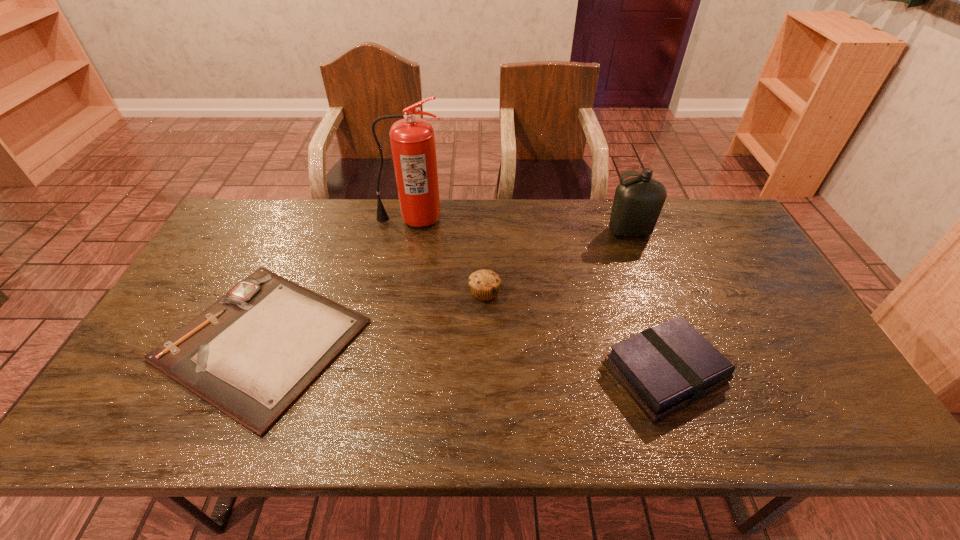
Image resolution: width=960 pixels, height=540 pixels. I want to click on the tallest object, so click(x=412, y=139).

I want to click on bottle, so click(638, 201).

Image resolution: width=960 pixels, height=540 pixels. Find the location of `muffin`. muffin is located at coordinates (484, 284).

In order to click on book in this screenshot , I will do `click(664, 368)`.

What are the coordinates of `clipboard` in the screenshot? It's located at click(252, 353).

Locate an element on the screen. Image resolution: width=960 pixels, height=540 pixels. vacant space located on the instruction side of the tallest object is located at coordinates (406, 253).

What are the coordinates of `free location located on the left of the bottle` in the screenshot? It's located at pos(570,232).

This screenshot has height=540, width=960. Find the location of `vacant space located on the back of the third object from right to left`. vacant space located on the back of the third object from right to left is located at coordinates (484, 204).

In order to click on vacant space located on the right of the book in this screenshot , I will do `click(782, 372)`.

This screenshot has height=540, width=960. What are the coordinates of `free space located on the right of the shortest object` in the screenshot? It's located at (468, 340).